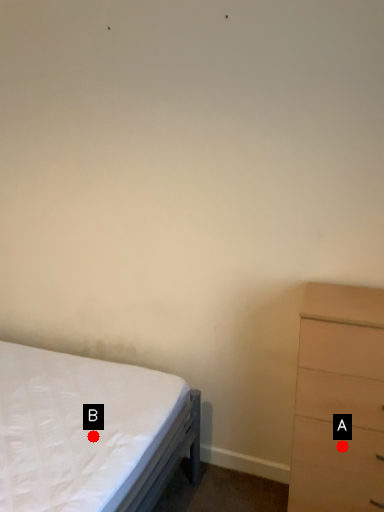
Question: Two points are circled on the image, labeled by A and B beside each circle. Which point is closer to the camera?

Choices:
 (A) A is closer
 (B) B is closer

Answer: (A)